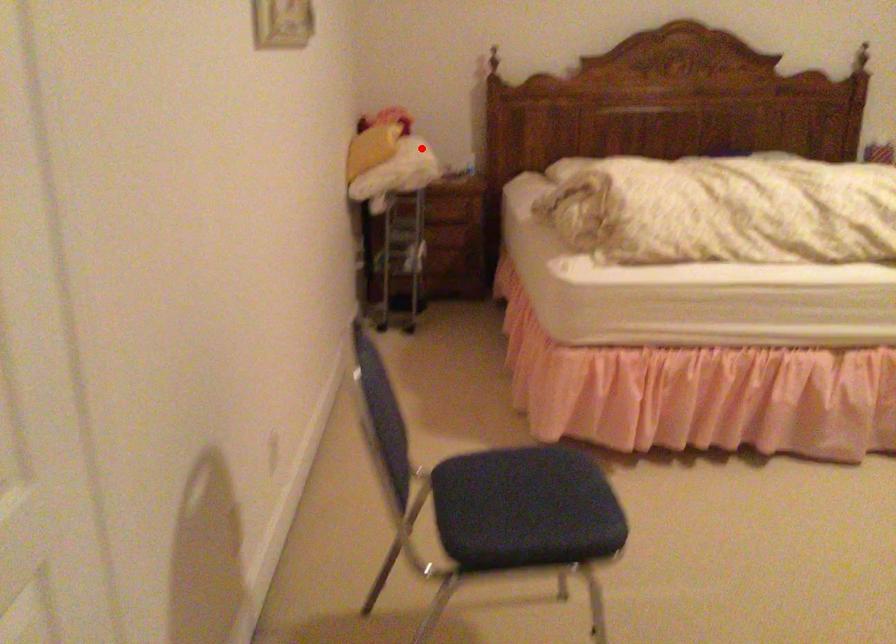
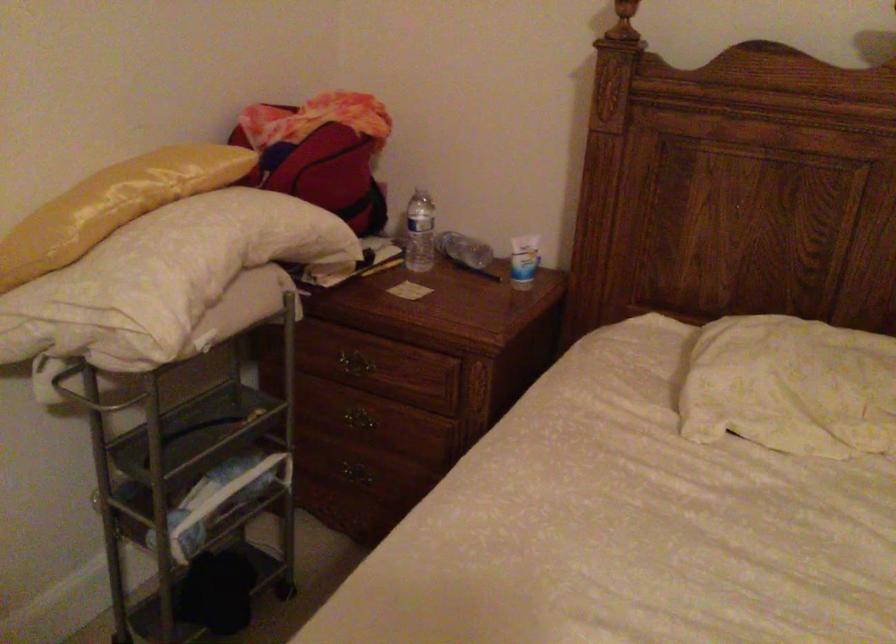
Question: I am providing you with two images of the same scene from different viewpoints. In image1, a red point is highlighted. Considering the same 3D point in image2, which of the following is correct?

Choices:
 (A) It is closer
 (B) It is farther

Answer: (A)